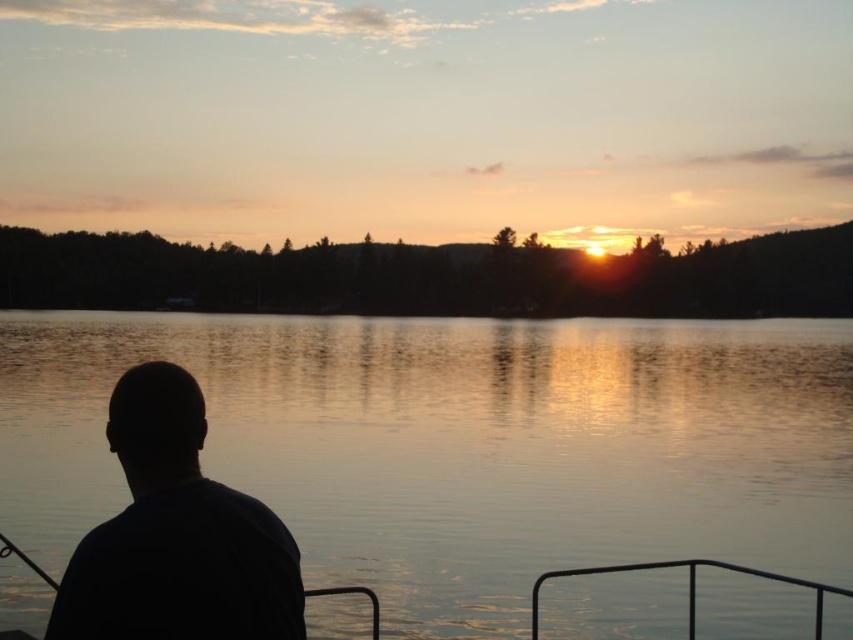
Question: Which point appears closest to the camera in this image?

Choices:
 (A) (664, 564)
 (B) (256, 600)
 (C) (207, 317)

Answer: (B)

Question: Does silvery water at center appear on the right side of black matte shirt at lower left?

Choices:
 (A) yes
 (B) no

Answer: (A)

Question: Which point is farther to the camera?

Choices:
 (A) (671, 561)
 (B) (279, 566)
 (C) (560, 596)

Answer: (C)

Question: Which object is positioned farthest from the black metal rail at lower right?

Choices:
 (A) silvery water at center
 (B) black matte shirt at lower left

Answer: (A)

Question: Is silvery water at center above black metal rail at lower right?

Choices:
 (A) no
 (B) yes

Answer: (B)

Question: Is silvery water at center behind black metal rail at lower right?

Choices:
 (A) yes
 (B) no

Answer: (B)